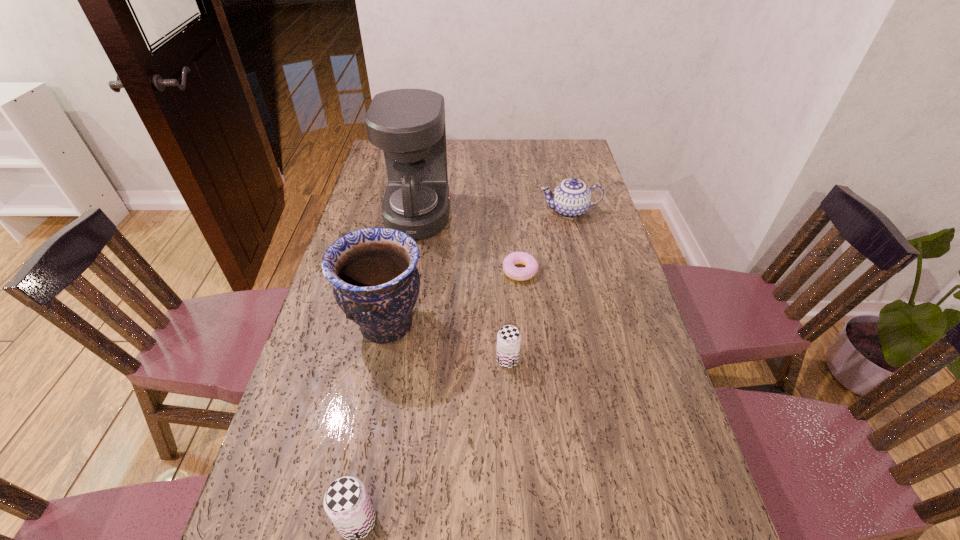
You are a GUI agent. You are given a task and a screenshot of the screen. Output one action in this format:
    pyautogui.click(x=<x>, y=<y>)
    Task: Click on the free region located from the spout of the rightmost object
    
    Given the screenshot: What is the action you would take?
    pyautogui.click(x=433, y=211)

I want to click on vacant space located on the front handle of the fifth shortest object, so click(519, 326).

This screenshot has height=540, width=960. What are the coordinates of `free space located on the back of the doughnut` in the screenshot? It's located at [x=514, y=206].

Where is `vacant space located on the button side of the tallest object`? The width and height of the screenshot is (960, 540). vacant space located on the button side of the tallest object is located at coordinates (538, 215).

Locate an element on the screen. The height and width of the screenshot is (540, 960). pottery that is at the left edge is located at coordinates (376, 283).

You are a GUI agent. You are given a task and a screenshot of the screen. Output one action in this format:
    pyautogui.click(x=<x>, y=<y>)
    Task: Click on the coffee maker at the left edge
    Image resolution: width=960 pixels, height=540 pixels.
    Given the screenshot: What is the action you would take?
    pyautogui.click(x=408, y=125)

Locate an element on the screen. This screenshot has height=540, width=960. object situated at the right edge is located at coordinates (571, 198).

Where is `free space at the far edge of the desktop`? free space at the far edge of the desktop is located at coordinates (449, 161).

Identify the location of free space at the left edge of the desktop. (368, 205).

Where is `vacant region at the right edge of the desktop`? vacant region at the right edge of the desktop is located at coordinates (604, 211).